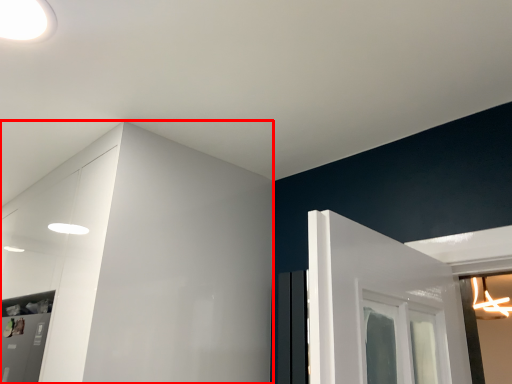
Question: In this image, where is dresser (annotated by the red box) located relative to light?

Choices:
 (A) right
 (B) left

Answer: (B)